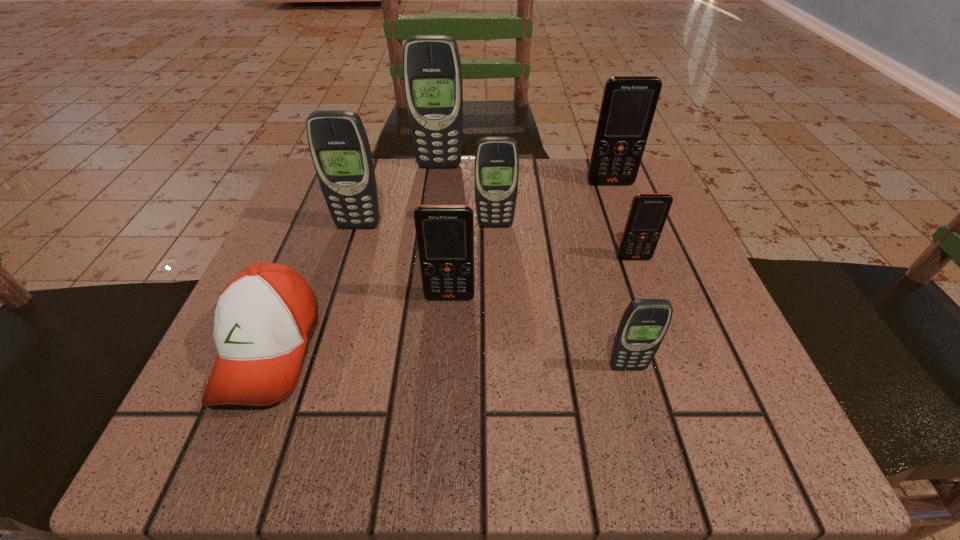
At what (x,y) coordinates should I click in order to perform the action: click on free spot at the right edge of the desktop. Please return your answer as a coordinate pair (x, y). Image resolution: width=960 pixels, height=540 pixels. Looking at the image, I should click on (722, 377).

I want to click on vacant region at the far right corner of the desktop, so click(617, 194).

This screenshot has height=540, width=960. What are the coordinates of `empty location between the biggest orange cellular telephone and the second gray cellular telephone from right to left` in the screenshot? It's located at (553, 204).

Where is `free space between the leftmost gray cellular telephone and the fifth farthest object`? This screenshot has width=960, height=540. free space between the leftmost gray cellular telephone and the fifth farthest object is located at coordinates pos(496,242).

Find the location of a particular element. unoccupied position between the smallest orange cellular telephone and the second farthest cellular telephone is located at coordinates (622, 221).

In order to click on vacant point located between the sixth nearest cellular telephone and the fourth nearest object in this screenshot , I will do `click(622, 221)`.

The height and width of the screenshot is (540, 960). I want to click on empty space that is in between the second farthest orange cellular telephone and the shortest object, so click(451, 303).

Image resolution: width=960 pixels, height=540 pixels. Identify the location of free space between the farthest gray cellular telephone and the fifth farthest object. (537, 212).

Identify the location of free space between the farthest cellular telephone and the second smallest gray cellular telephone. (468, 195).

I want to click on vacant space that's between the nearest gray cellular telephone and the second biggest gray cellular telephone, so click(493, 296).